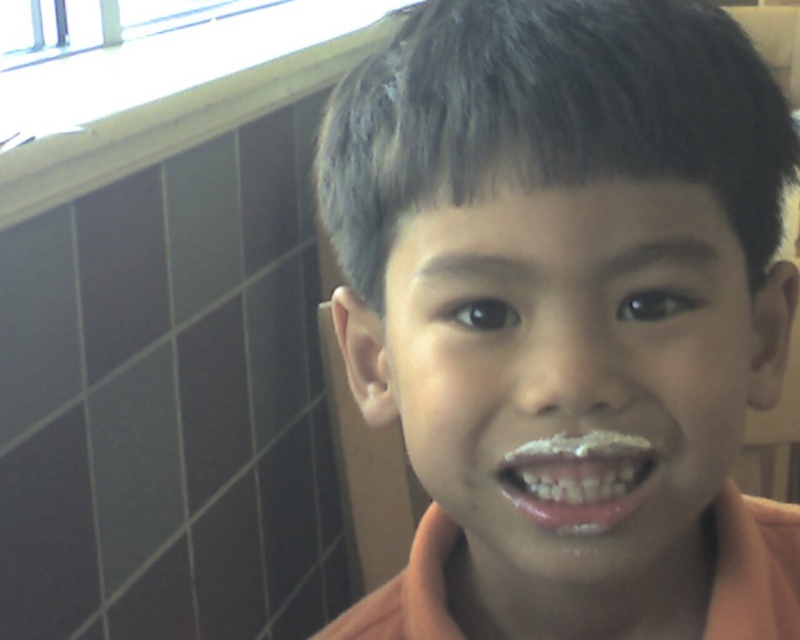
Question: Which point is farther to the camera?

Choices:
 (A) (482, 348)
 (B) (584, 540)

Answer: (A)

Question: Is orange matte shirt at center thinner than white glossy frosting at mouth?

Choices:
 (A) yes
 (B) no

Answer: (B)

Question: Is smooth skin face at center further to the viewer compared to shiny pink lips at center?

Choices:
 (A) yes
 (B) no

Answer: (B)

Question: Which of the following is the farthest from the observer?

Choices:
 (A) (721, 428)
 (B) (548, 456)

Answer: (A)

Question: Estimate the real-world distances between objects in this image. Which object is closer to the shiny pink lips at center?

Choices:
 (A) orange matte shirt at center
 (B) white glossy frosting at mouth

Answer: (B)

Question: Does shiny pink lips at center appear on the right side of white glossy frosting at mouth?

Choices:
 (A) yes
 (B) no

Answer: (B)